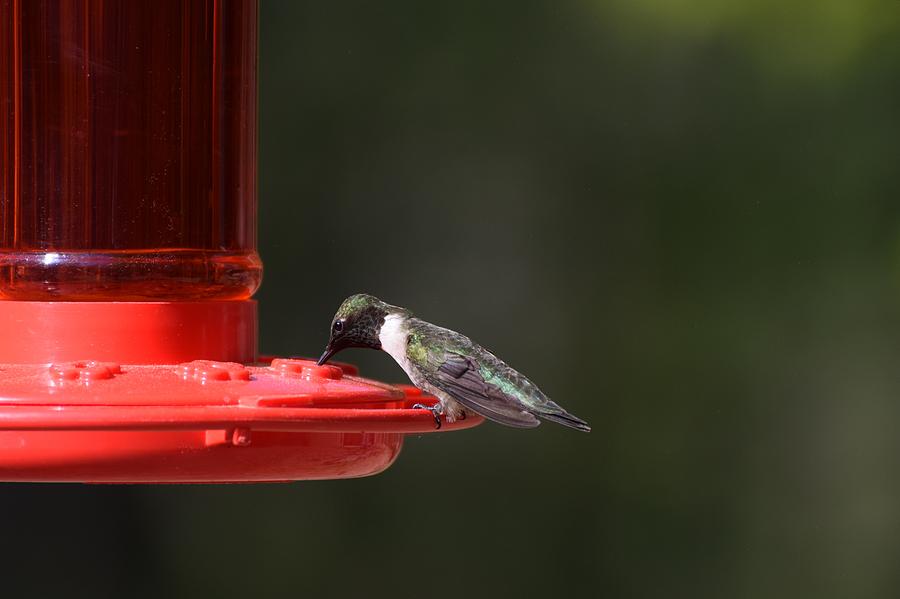
Image resolution: width=900 pixels, height=599 pixels. I want to click on stand, so click(x=165, y=331).